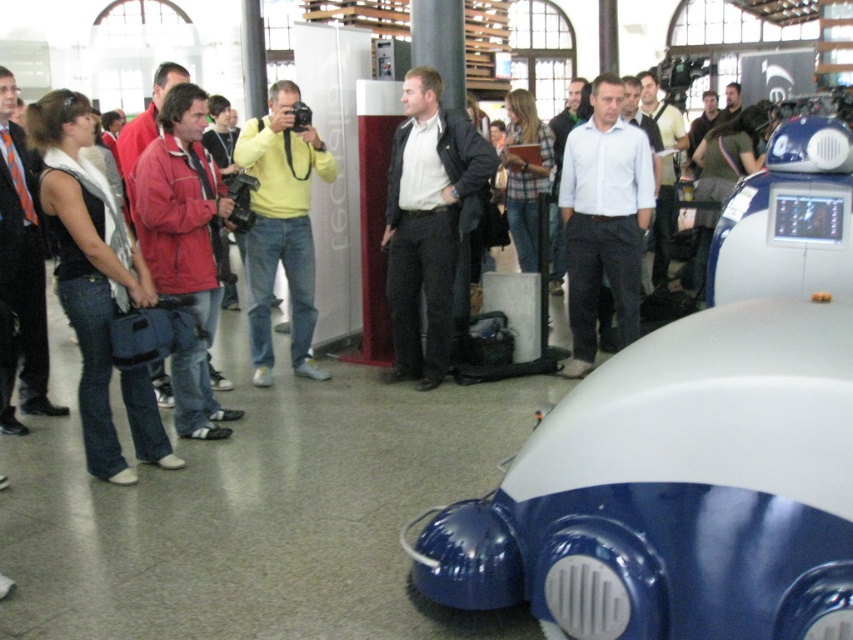
Question: Is matte black jacket at center positioned at the back of yellow matte shirt at center?

Choices:
 (A) yes
 (B) no

Answer: (A)

Question: In this image, where is matte black jacket at center located relative to white shirt at center?

Choices:
 (A) above
 (B) below

Answer: (B)

Question: Which point is closer to the camera taking this photo?

Choices:
 (A) (283, 161)
 (B) (585, 246)
 (C) (399, 204)

Answer: (C)

Question: Which of these objects is positioned farthest from the yellow matte shirt at center?

Choices:
 (A) matte black jacket at center
 (B) white shirt at center

Answer: (B)

Question: Does matte black jacket at center have a larger size compared to white shirt at center?

Choices:
 (A) yes
 (B) no

Answer: (B)

Question: Which point is closer to the camera?

Choices:
 (A) (395, 372)
 (B) (271, 212)
 (C) (628, 164)

Answer: (C)